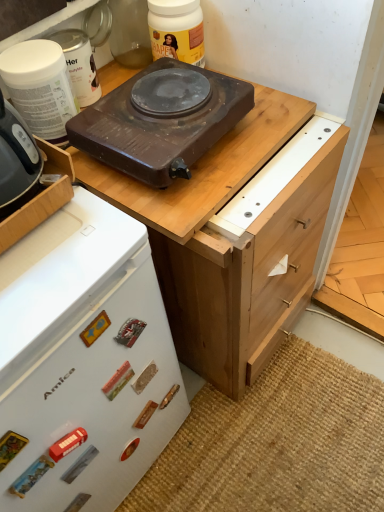
Identify the location of blank space above brown matte electric stove at upper center, positioned as the second kitchen appliance in right-to-left order (from a real-world perspective). (167, 90).